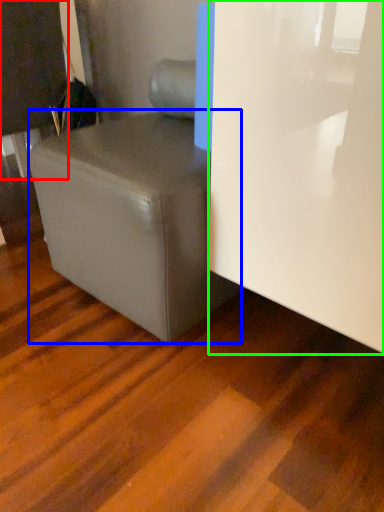
Question: Which is farther away from furniture (highlighted by a red box)? table (highlighted by a blue box) or glass door (highlighted by a green box)?

Choices:
 (A) table
 (B) glass door

Answer: (B)